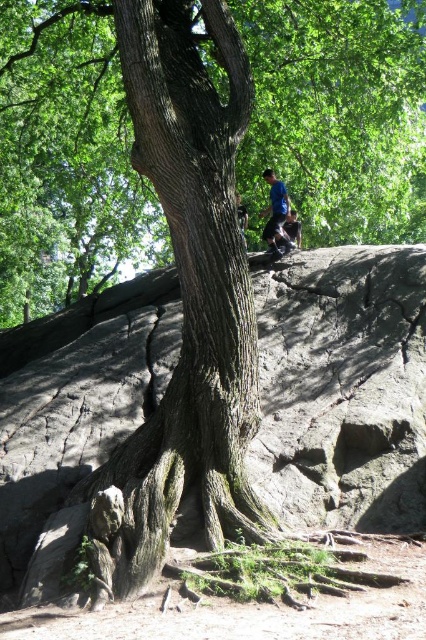
Question: Among these objects, which one is farthest from the camera?

Choices:
 (A) rough bark tree trunk at center
 (B) blue fabric shirt at upper center

Answer: (B)

Question: Considering the relative positions of rough bark tree trunk at center and blue fabric shirt at upper center in the image provided, where is rough bark tree trunk at center located with respect to blue fabric shirt at upper center?

Choices:
 (A) right
 (B) left

Answer: (B)

Question: Which point is closer to the camera?

Choices:
 (A) (155, 147)
 (B) (284, 188)

Answer: (A)

Question: Can you confirm if rough bark tree trunk at center is wider than blue fabric shirt at upper center?

Choices:
 (A) yes
 (B) no

Answer: (A)

Question: Does rough bark tree trunk at center appear over blue fabric shirt at upper center?

Choices:
 (A) yes
 (B) no

Answer: (B)